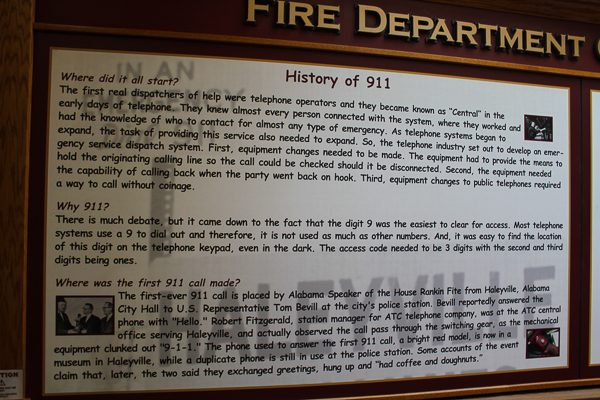
The image size is (600, 400). Find the location of `wood framing`. wood framing is located at coordinates (486, 391), (432, 57), (26, 157).